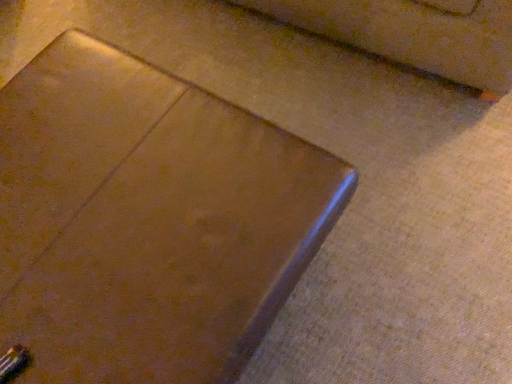
The width and height of the screenshot is (512, 384). I want to click on free location above metallic square tray at center (from a real-world perspective), so click(108, 203).